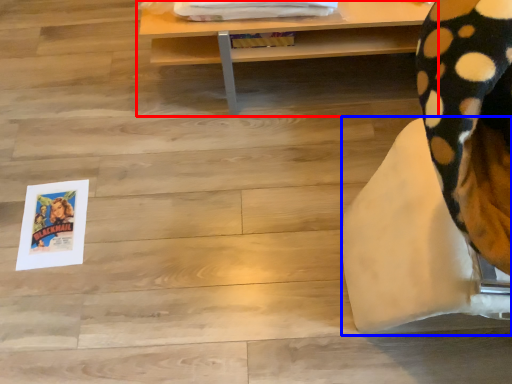
Question: Which object appears closest to the camera in this image, table (highlighted by a red box) or furniture (highlighted by a blue box)?

Choices:
 (A) table
 (B) furniture

Answer: (B)